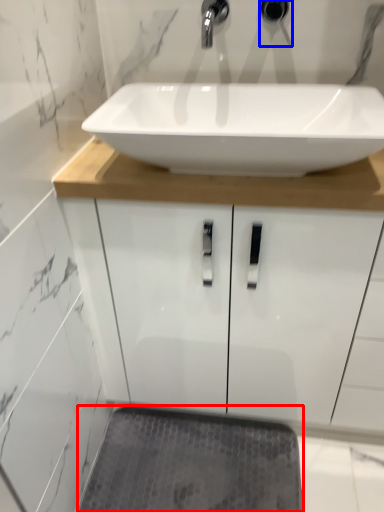
Question: Which object appears closest to the camera in this image, bath mat (highlighted by a red box) or plumbing fixture (highlighted by a blue box)?

Choices:
 (A) bath mat
 (B) plumbing fixture

Answer: (B)